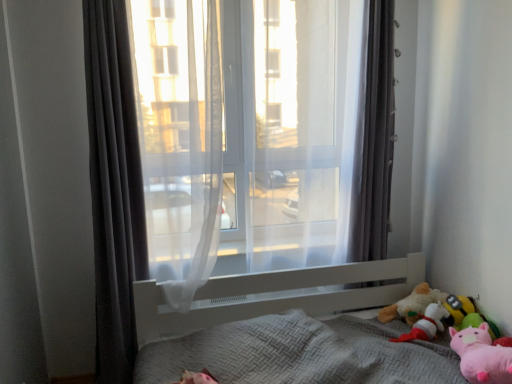
Question: Relative to fluffy plush toy at lower right, which is the first toy from back to front, is textured gray bed at lower right in front or behind?

Choices:
 (A) behind
 (B) front

Answer: (B)

Question: Is textured gray bed at lower right taller or shorter than fluffy plush toy at lower right, which is the first toy from back to front?

Choices:
 (A) tall
 (B) short

Answer: (A)

Question: Estimate the real-world distances between objects in this image. Which object is farther from the pink plush toy at lower right, which is the first toy from front to back?

Choices:
 (A) pink plush toy at lower right
 (B) translucent fabric at center
 (C) dark gray fabric curtain at left, placed as the 2th curtain when sorted from right to left
 (D) fluffy plush toy at lower right, which is the first toy from back to front
 (E) soft plush toy at lower right, the 3th toy when ordered from front to back

Answer: (C)

Question: Considering the real-world distances, which object is closest to the pink plush toy at lower right, which is the first toy from front to back?

Choices:
 (A) soft plush toy at lower right, the 2th toy in the back-to-front sequence
 (B) textured gray bed at lower right
 (C) pink plush toy at lower right
 (D) dark gray fabric curtain at left, the first curtain from the left
 (E) dark gray fabric curtain at right, arranged as the first curtain when viewed from the right

Answer: (A)